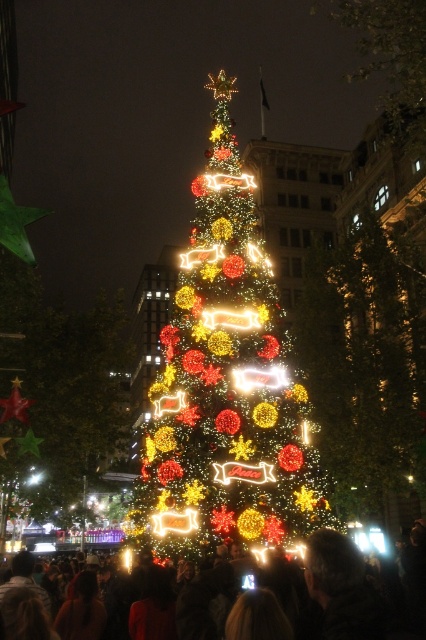
You are standing in a public square where there is an illuminated plastic Christmas tree at center. You want to take a photo of the tree using your camera. Considering the distance between you and the tree, will your camera be able to capture the entire tree in one shot without zooming in?

The illuminated plastic Christmas tree at center and the camera are 71.02 meters apart. Since the camera is 71.02 meters away from the tree, it may not be able to capture the entire tree in one shot without zooming in, as standard camera lenses typically have a limited field of view at such distances.

You are organizing a Christmas event and need to ensure that the illuminated plastic christmas tree at center is visible to everyone in the matte black crowd at center. Based on their widths, will the tree be easily seen by the crowd?

The illuminated plastic christmas tree at center has a lesser width compared to the matte black crowd at center. This means the tree may be less visible to the crowd due to its narrower width, so additional lighting or positioning adjustments might be needed to ensure visibility.